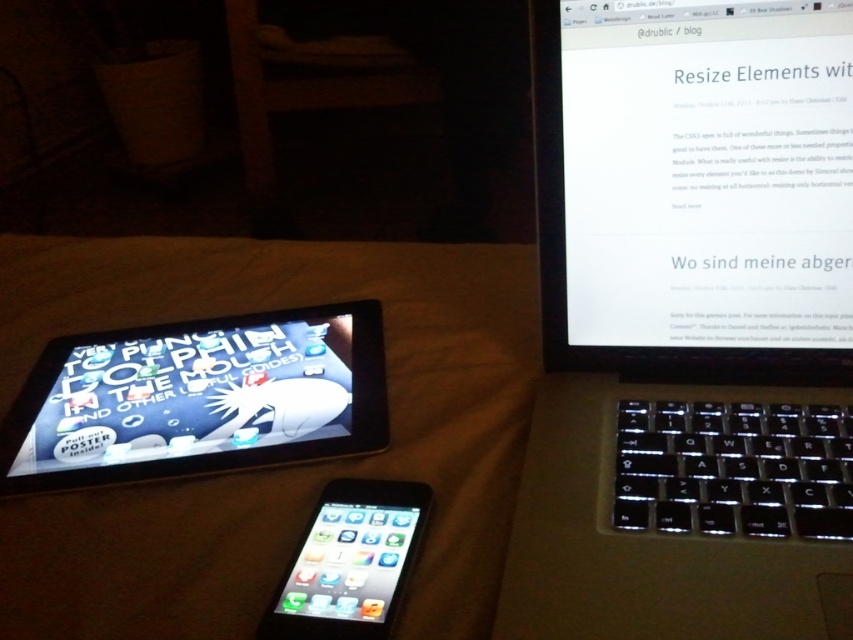
Question: Does black plastic laptop at center have a lesser width compared to white glossy screen at upper center?

Choices:
 (A) no
 (B) yes

Answer: (A)

Question: Does black plastic laptop at center lie in front of matte black tablet at lower left?

Choices:
 (A) no
 (B) yes

Answer: (B)

Question: Among these objects, which one is nearest to the camera?

Choices:
 (A) matte black tablet at lower left
 (B) white glossy screen at upper center
 (C) black plastic laptop at center

Answer: (C)

Question: Among these points, which one is nearest to the camera?

Choices:
 (A) (55, 397)
 (B) (338, 490)
 (C) (740, 16)
 (D) (717, 360)

Answer: (C)

Question: Among these objects, which one is farthest from the camera?

Choices:
 (A) white glossy screen at upper center
 (B) black plastic laptop at center

Answer: (A)

Question: Does matte black tablet at left appear on the left side of matte black tablet at lower left?

Choices:
 (A) no
 (B) yes

Answer: (B)